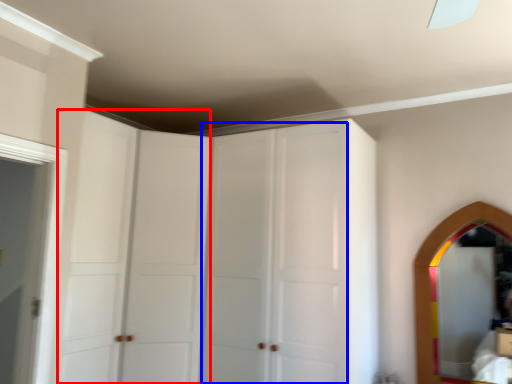
Question: Which point is further to the camera, glass door (highlighted by a red box) or glass door (highlighted by a blue box)?

Choices:
 (A) glass door
 (B) glass door

Answer: (B)